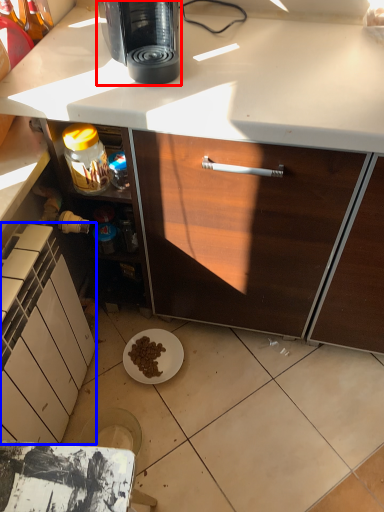
Question: Among these objects, which one is nearest to the camera, coffee maker (highlighted by a red box) or cabinetry (highlighted by a blue box)?

Choices:
 (A) coffee maker
 (B) cabinetry

Answer: (B)